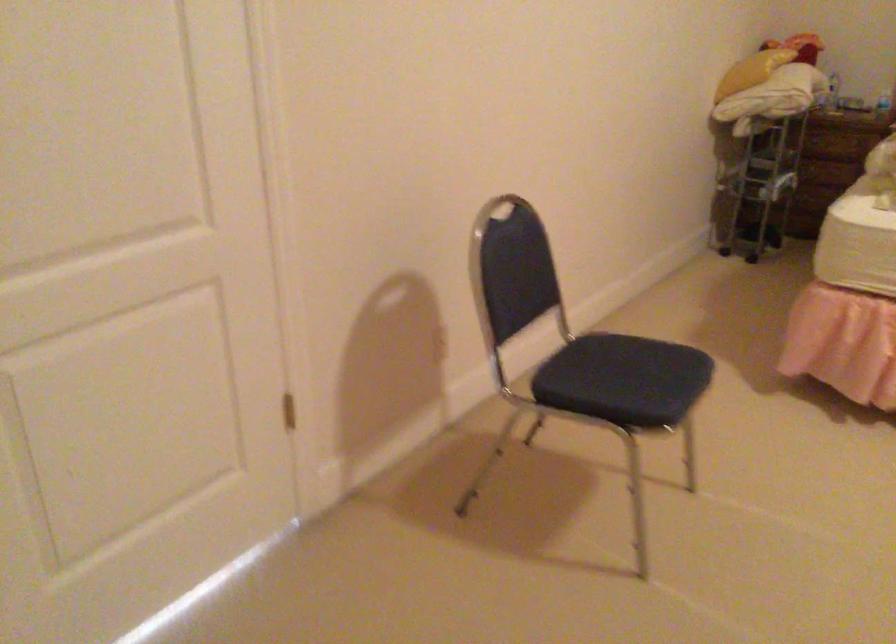
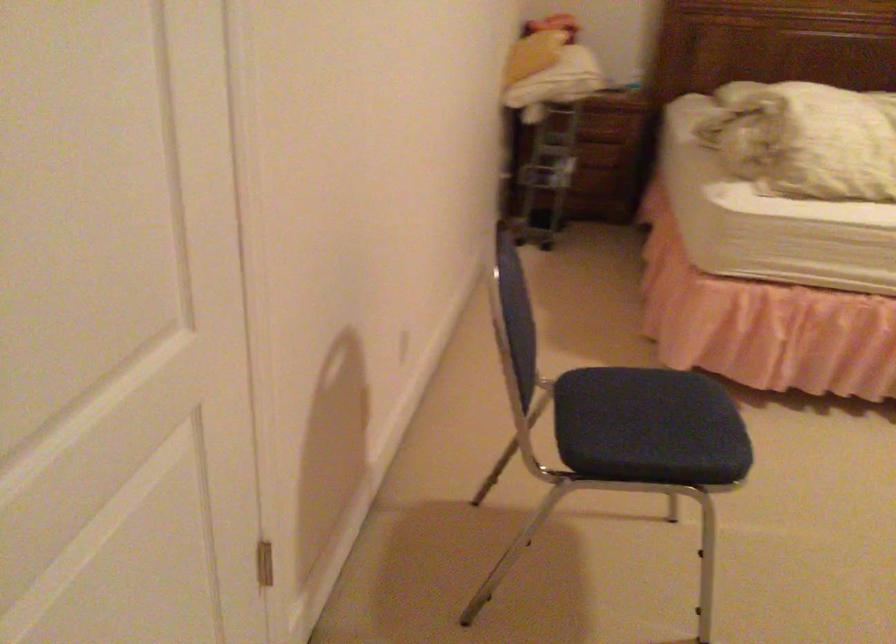
The images are taken continuously from a first-person perspective. In which direction are you moving?

The cameraman moved toward left, forward.